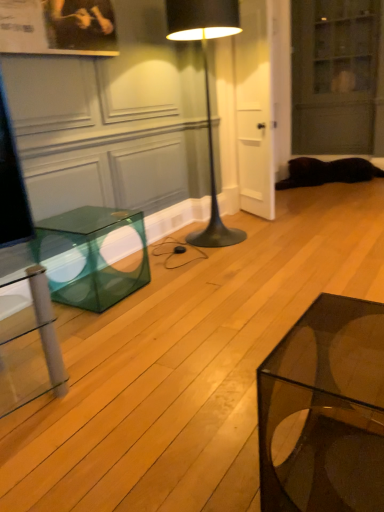
Image resolution: width=384 pixels, height=512 pixels. What are the coordinates of `free spot in front of transparent glass cube at left` in the screenshot? It's located at (117, 330).